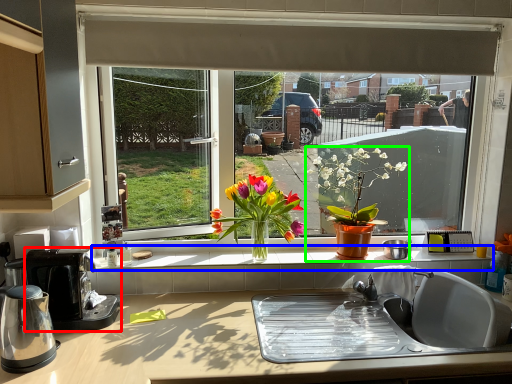
Question: Which object is positioned farthest from coffee maker (highlighted by a red box)? Select from window sill (highlighted by a blue box) and houseplant (highlighted by a green box).

Choices:
 (A) window sill
 (B) houseplant

Answer: (B)